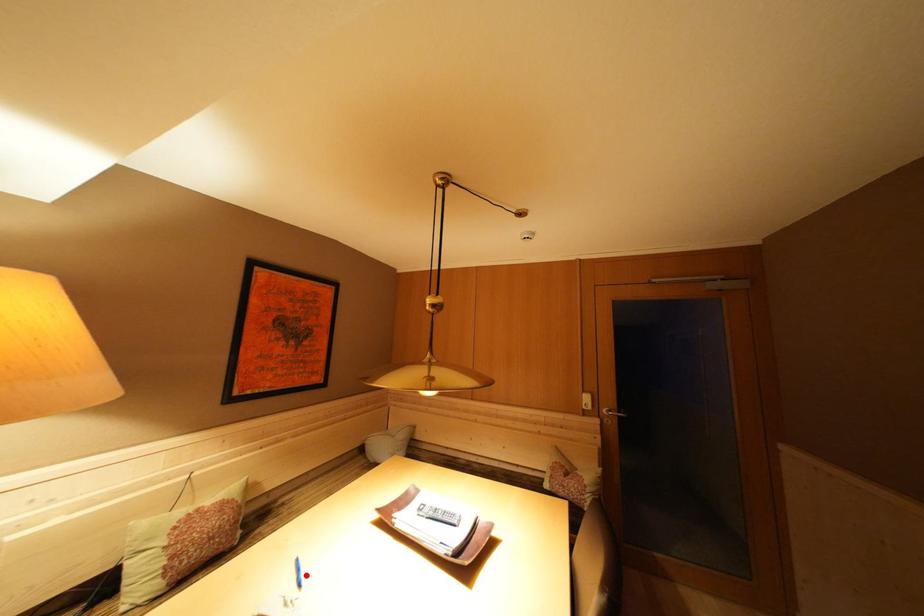
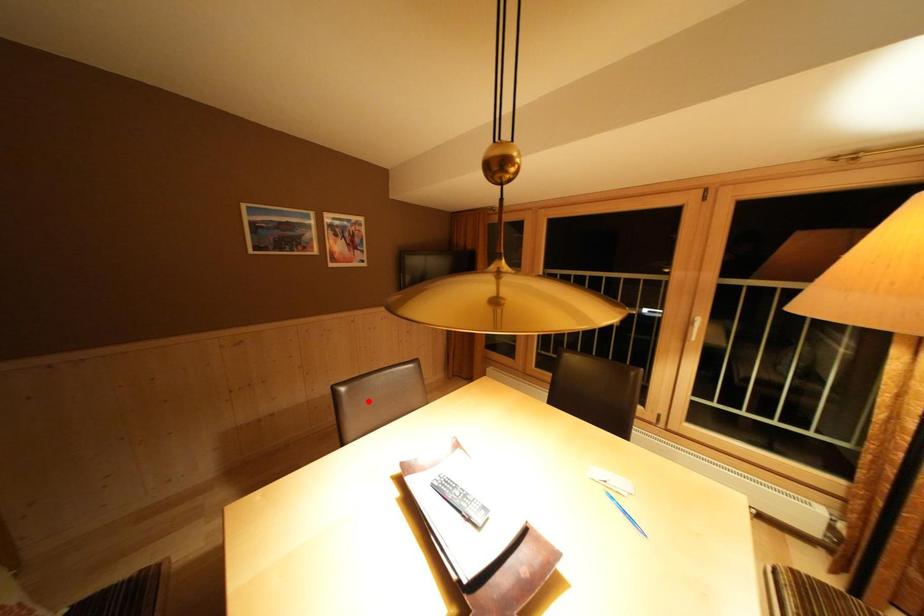
I am providing you with two images of the same scene from different viewpoints. A red point is marked on the first image and another point is marked on the second image. Are the points marked in image1 and image2 representing the same 3D position?

No